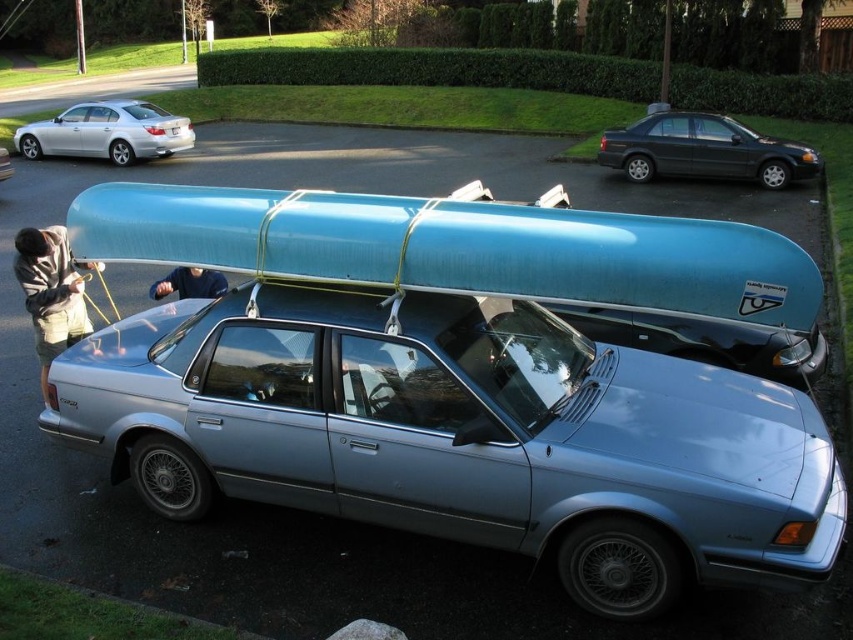
Question: Does satin silver sedan at center have a smaller size compared to silver metallic sedan at upper left?

Choices:
 (A) yes
 (B) no

Answer: (A)

Question: Can you confirm if matte black sedan at upper right is positioned below silver metallic sedan at upper left?

Choices:
 (A) no
 (B) yes

Answer: (B)

Question: Which point is closer to the camera?

Choices:
 (A) (700, 161)
 (B) (135, 141)
 (C) (49, 264)
 (D) (404, 324)

Answer: (D)

Question: Does satin silver sedan at center appear on the left side of khaki shorts at lower left?

Choices:
 (A) yes
 (B) no

Answer: (B)

Question: Among these objects, which one is nearest to the camera?

Choices:
 (A) dark blue shirt at upper center
 (B) satin silver sedan at center

Answer: (B)

Question: Which object appears closest to the camera in this image?

Choices:
 (A) matte black sedan at upper right
 (B) satin silver sedan at center

Answer: (B)